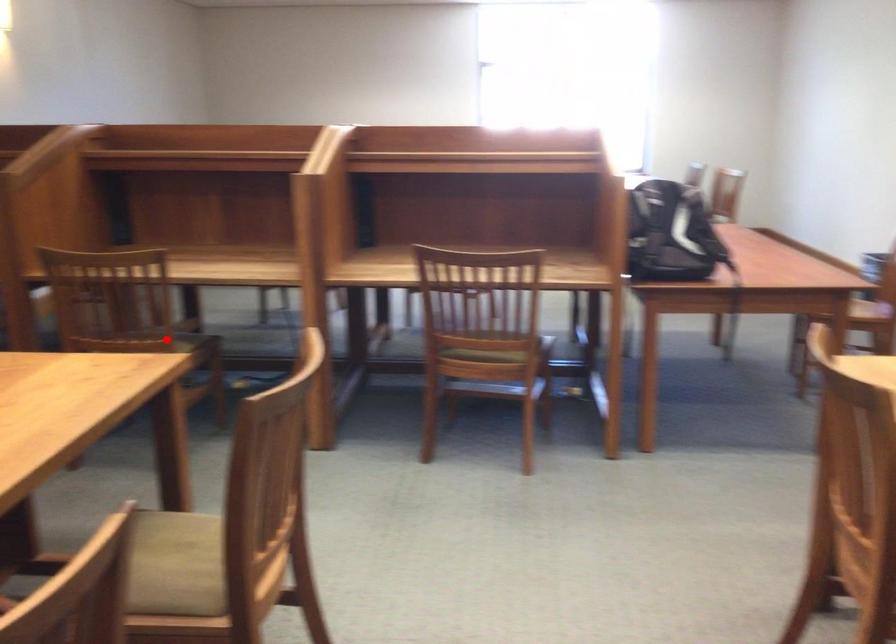
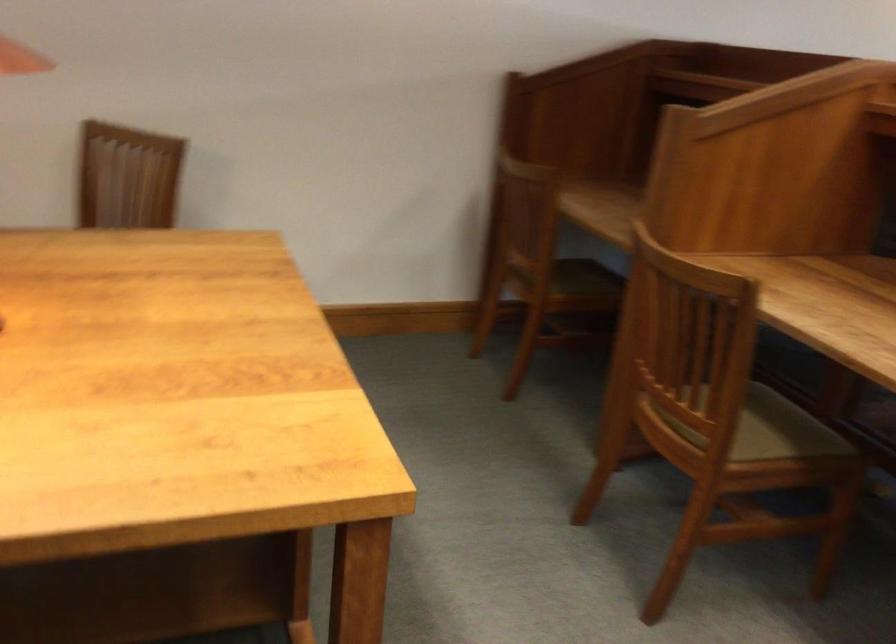
Question: A red point is marked in image1. In image2, is the corresponding 3D point closer to the camera or farther? Reply with the corresponding letter.

Choices:
 (A) The corresponding 3D point is closer.
 (B) The corresponding 3D point is farther.

Answer: (A)